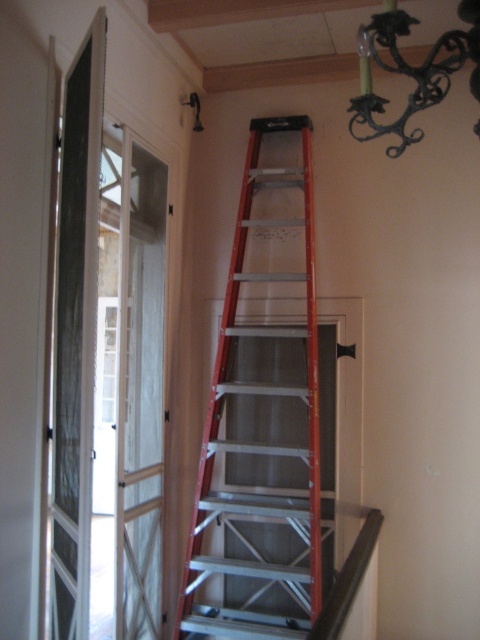
You are a painter needing to reach the ceiling fixture. You see an orange metallic ladder at center and a black wrought iron chandelier at upper right. Which object is closer to you in the scene?

The orange metallic ladder at center is closer to you than the black wrought iron chandelier at upper right because it is positioned to the left of the chandelier, which places it in a more forward spatial position.

You are a painter who needs to reach the ceiling to touch up some paint. You see the orange metallic ladder at center and the black wrought iron chandelier at upper right. Which object is closer to you, and why?

The orange metallic ladder at center is closer to you because it is further to the viewer than the black wrought iron chandelier at upper right.

You are a painter who needs to reach the ceiling to paint it. You see an orange metallic ladder at center and a black wrought iron chandelier at upper right. Which object is taller and can you use the ladder to reach the chandelier?

The orange metallic ladder at center is taller than the black wrought iron chandelier at upper right. Since the ladder is taller, you can use it to reach the chandelier.